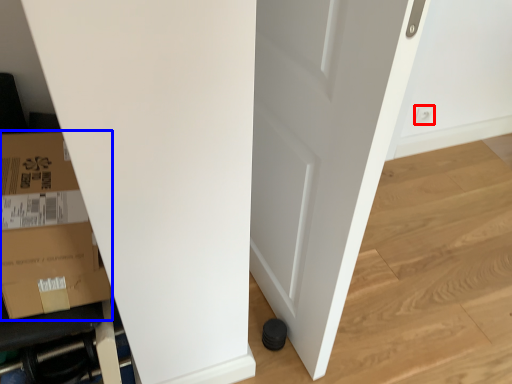
Question: Which object is further to the camera taking this photo, electric outlet (highlighted by a red box) or cardboard box (highlighted by a blue box)?

Choices:
 (A) electric outlet
 (B) cardboard box

Answer: (A)